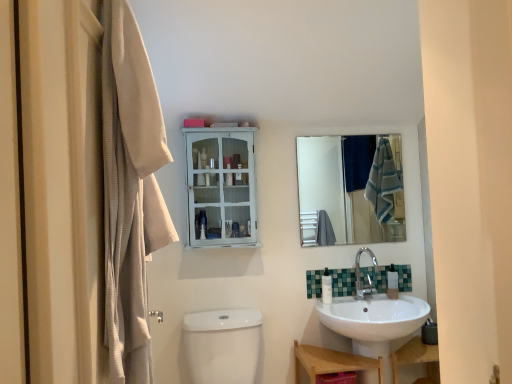
What are the coordinates of `wooden shelf at lower right` in the screenshot? It's located at (331, 362).

Identify the location of white painted wood cabinet at upper center. (221, 187).

What do you see at coordinates (130, 191) in the screenshot?
I see `beige textured towel at left` at bounding box center [130, 191].

Identify the location of white glossy soap dispenser at lower center, which ranks as the second toiletry in right-to-left order. (326, 287).

Looking at their sizes, would you say beige textured towel at left is wider or thinner than white glossy soap dispenser at lower right, the 2th toiletry in the left-to-right sequence?

Clearly, beige textured towel at left has more width compared to white glossy soap dispenser at lower right, the 2th toiletry in the left-to-right sequence.

Is point (145, 366) farther from viewer compared to point (387, 281)?

No.

Which of these two, beige textured towel at left or white glossy soap dispenser at lower right, the 2th toiletry in the left-to-right sequence, stands taller?

Standing taller between the two is beige textured towel at left.

Where is `the 2nd toiletry to the right when counting from the beige textured towel at left`? the 2nd toiletry to the right when counting from the beige textured towel at left is located at coordinates (392, 283).

Does point (207, 356) lie in front of point (209, 221)?

That is True.

Is white glossy toilet bowl at lower center shorter than white painted wood cabinet at upper center?

Yes.

Is white glossy toilet bowl at lower center oriented away from white painted wood cabinet at upper center?

No, white painted wood cabinet at upper center is not at the back of white glossy toilet bowl at lower center.

From the image's perspective, which object appears higher, white glossy toilet bowl at lower center or white painted wood cabinet at upper center?

From the image's view, white painted wood cabinet at upper center is above.

How many degrees apart are the facing directions of white glossy soap dispenser at lower right, the 2th toiletry in the left-to-right sequence, and beige textured towel at left?

89.3 degrees separate the facing orientations of white glossy soap dispenser at lower right, the 2th toiletry in the left-to-right sequence, and beige textured towel at left.

From the beige textured towel at left, count 2nd toiletry to the right and point to it. Please provide its 2D coordinates.

[(392, 283)]

Which object is thinner, white glossy soap dispenser at lower right, which is the 1th toiletry from right to left, or beige textured towel at left?

Thinner between the two is white glossy soap dispenser at lower right, which is the 1th toiletry from right to left.

From the image's perspective, does white glossy soap dispenser at lower right, the 2th toiletry in the left-to-right sequence, appear lower than beige textured towel at left?

Correct, white glossy soap dispenser at lower right, the 2th toiletry in the left-to-right sequence, appears lower than beige textured towel at left in the image.

In the scene shown: Is clear glass mirror at upper center looking in the opposite direction of metallic silver faucet at lower center?

No, metallic silver faucet at lower center is not at the back of clear glass mirror at upper center.

From the image's perspective, is clear glass mirror at upper center positioned above or below metallic silver faucet at lower center?

Based on their image positions, clear glass mirror at upper center is located above metallic silver faucet at lower center.

From their relative heights in the image, would you say clear glass mirror at upper center is taller or shorter than metallic silver faucet at lower center?

Considering their sizes, clear glass mirror at upper center has more height than metallic silver faucet at lower center.

Is clear glass mirror at upper center not inside metallic silver faucet at lower center?

That's correct, clear glass mirror at upper center is outside of metallic silver faucet at lower center.

Which of these two, wooden shelf at lower right or metallic silver faucet at lower center, stands taller?

wooden shelf at lower right.

Can you tell me how much wooden shelf at lower right and metallic silver faucet at lower center differ in facing direction?

The angle between the facing direction of wooden shelf at lower right and the facing direction of metallic silver faucet at lower center is 0.208 degrees.

From a real-world perspective, is wooden shelf at lower right over metallic silver faucet at lower center?

Incorrect, from a real-world perspective, wooden shelf at lower right is lower than metallic silver faucet at lower center.

From the image's perspective, which object appears higher, wooden shelf at lower right or metallic silver faucet at lower center?

metallic silver faucet at lower center.

From a real-world perspective, which is physically above, wooden shelf at lower right or silver metallic faucet at lower right?

silver metallic faucet at lower right is physically above.

Could you tell me if wooden shelf at lower right is facing silver metallic faucet at lower right?

No, wooden shelf at lower right does not turn towards silver metallic faucet at lower right.

Measure the distance between wooden shelf at lower right and silver metallic faucet at lower right.

wooden shelf at lower right is 16.76 inches away from silver metallic faucet at lower right.

Does wooden shelf at lower right have a smaller size compared to silver metallic faucet at lower right?

Actually, wooden shelf at lower right might be larger than silver metallic faucet at lower right.

Between white painted wood cabinet at upper center and white glossy toilet bowl at lower center, which one appears on the left side from the viewer's perspective?

white painted wood cabinet at upper center.

Looking at this image, is white painted wood cabinet at upper center in front of or behind white glossy toilet bowl at lower center in the image?

In the image, white painted wood cabinet at upper center appears behind white glossy toilet bowl at lower center.

Can you confirm if white painted wood cabinet at upper center is bigger than white glossy toilet bowl at lower center?

Incorrect, white painted wood cabinet at upper center is not larger than white glossy toilet bowl at lower center.

Which toiletry is the 2nd one when counting from the back of the beige textured towel at left? Please provide its 2D coordinates.

[(392, 283)]

In the image, there is a white painted wood cabinet at upper center. Where is `toilet bowl below it (from the image's perspective)`? This screenshot has height=384, width=512. toilet bowl below it (from the image's perspective) is located at coordinates click(x=222, y=345).

Looking at the image, which one is located further to white glossy soap dispenser at lower center, which is counted as the 1th toiletry, starting from the left, white painted wood cabinet at upper center or wooden shelf at lower right?

white painted wood cabinet at upper center is positioned further to the anchor white glossy soap dispenser at lower center, which is counted as the 1th toiletry, starting from the left.

Looking at the image, which one is located closer to white glossy soap dispenser at lower center, which is counted as the 1th toiletry, starting from the left, white glossy toilet bowl at lower center or metallic silver faucet at lower center?

metallic silver faucet at lower center.

Based on their spatial positions, is beige textured towel at left or silver metallic faucet at lower right further from white glossy soap dispenser at lower center, which ranks as the second toiletry in right-to-left order?

beige textured towel at left lies further to white glossy soap dispenser at lower center, which ranks as the second toiletry in right-to-left order, than the other object.

Based on their spatial positions, is metallic silver faucet at lower center or white glossy soap dispenser at lower center, which ranks as the second toiletry in right-to-left order, closer to wooden shelf at lower right?

white glossy soap dispenser at lower center, which ranks as the second toiletry in right-to-left order.

Estimate the real-world distances between objects in this image. Which object is closer to silver metallic faucet at lower right, wooden shelf at lower right or white glossy soap dispenser at lower right, the 2th toiletry in the left-to-right sequence?

white glossy soap dispenser at lower right, the 2th toiletry in the left-to-right sequence.

Based on their spatial positions, is silver metallic faucet at lower right or metallic silver faucet at lower center closer to white glossy soap dispenser at lower right, the 2th toiletry in the left-to-right sequence?

silver metallic faucet at lower right is positioned closer to the anchor white glossy soap dispenser at lower right, the 2th toiletry in the left-to-right sequence.

Looking at the image, which one is located further to white glossy soap dispenser at lower center, which ranks as the second toiletry in right-to-left order, wooden shelf at lower right or metallic silver faucet at lower center?

Among the two, wooden shelf at lower right is located further to white glossy soap dispenser at lower center, which ranks as the second toiletry in right-to-left order.

Based on their spatial positions, is clear glass mirror at upper center or white glossy soap dispenser at lower center, which ranks as the second toiletry in right-to-left order, closer to white glossy soap dispenser at lower right, which is the 1th toiletry from right to left?

white glossy soap dispenser at lower center, which ranks as the second toiletry in right-to-left order, is closer to white glossy soap dispenser at lower right, which is the 1th toiletry from right to left.

Locate an element on the screen. This screenshot has height=384, width=512. mirror between white painted wood cabinet at upper center and wooden shelf at lower right vertically is located at coordinates (351, 188).

Image resolution: width=512 pixels, height=384 pixels. In order to click on toilet bowl between white painted wood cabinet at upper center and metallic silver faucet at lower center in this screenshot , I will do `click(222, 345)`.

Locate an element on the screen. Image resolution: width=512 pixels, height=384 pixels. furniture between white glossy toilet bowl at lower center and white glossy soap dispenser at lower center, which ranks as the second toiletry in right-to-left order, in the front-back direction is located at coordinates (331, 362).

What are the coordinates of `toilet bowl between white painted wood cabinet at upper center and wooden shelf at lower right vertically` in the screenshot? It's located at (222, 345).